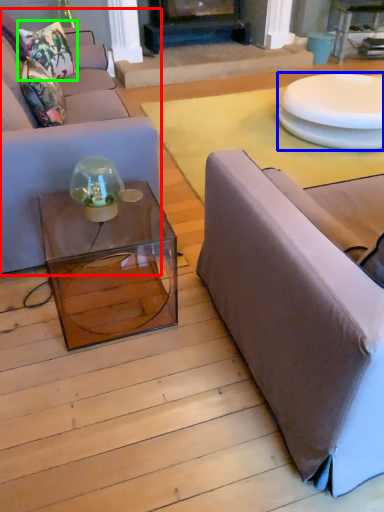
Question: Which object is positioned closest to studio couch (highlighted by a red box)? Select from round table (highlighted by a blue box) and pillow (highlighted by a green box).

Choices:
 (A) round table
 (B) pillow

Answer: (B)